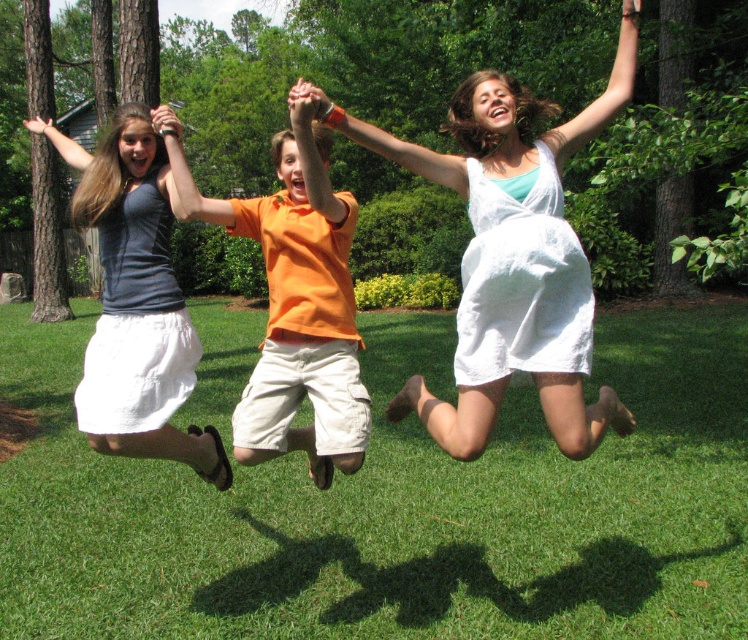
In the scene shown: You are planning to take a photo of the green grass at center and the white linen dress at center. Based on their positions, which one will be in focus if you focus on the background?

The white linen dress at center will be in focus because it is behind the green grass at center, so when focusing on the background, the dress will be clearer while the grass may be slightly out of focus.

Based on the scene description, can you determine if the green grass at center is wider than the matte gray tank top at center?

The green grass at center is wider than the matte gray tank top at center according to the description.

You are standing at the point marked as point (266, 616) in the image. The distance from you to the viewer is 3.51 meters. If you want to throw a frisbee to someone standing 5 meters away from you, will they be within your throwing range?

The distance from point (266, 616) to the viewer is 3.51 meters. If someone is standing 5 meters away from you at that point, they would be 5 meters away from you, which is beyond your throwing range of 3.51 meters. Therefore, they would not be within your throwing range.